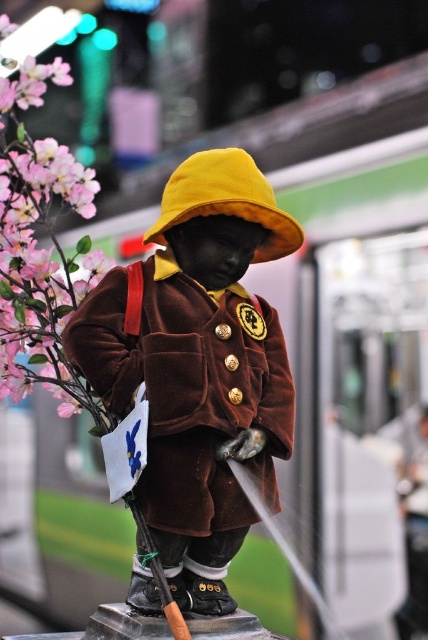
Between velvet brown coat at center and matte pink petals at left, which one has more height?

velvet brown coat at center

Is velvet brown coat at center to the right of matte pink petals at left from the viewer's perspective?

Yes, velvet brown coat at center is to the right of matte pink petals at left.

This screenshot has width=428, height=640. What do you see at coordinates (199, 365) in the screenshot?
I see `velvet brown coat at center` at bounding box center [199, 365].

Where is `velvet brown coat at center`? Image resolution: width=428 pixels, height=640 pixels. velvet brown coat at center is located at coordinates (199, 365).